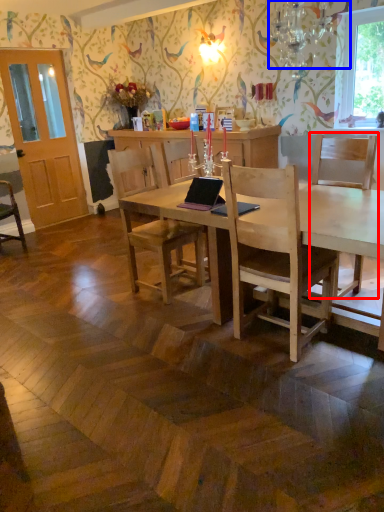
Question: Which object appears closest to the camera in this image, chair (highlighted by a red box) or lamp (highlighted by a blue box)?

Choices:
 (A) chair
 (B) lamp

Answer: (B)